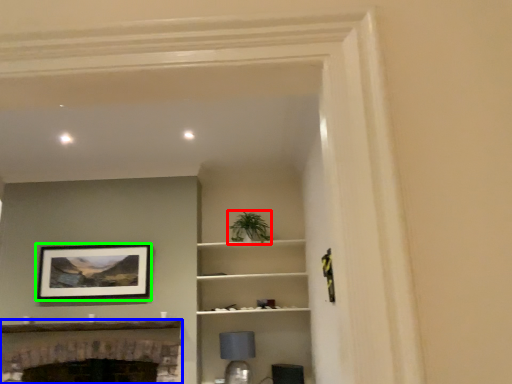
Question: Which is nearer to the plant (highlighted by a red box)? fireplace (highlighted by a blue box) or picture frame (highlighted by a green box).

Choices:
 (A) fireplace
 (B) picture frame

Answer: (B)